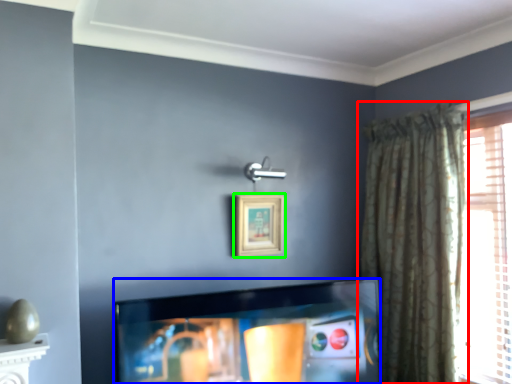
Question: Which object is positioned closest to curtain (highlighted by a red box)? Select from television (highlighted by a blue box) and picture frame (highlighted by a green box).

Choices:
 (A) television
 (B) picture frame

Answer: (A)